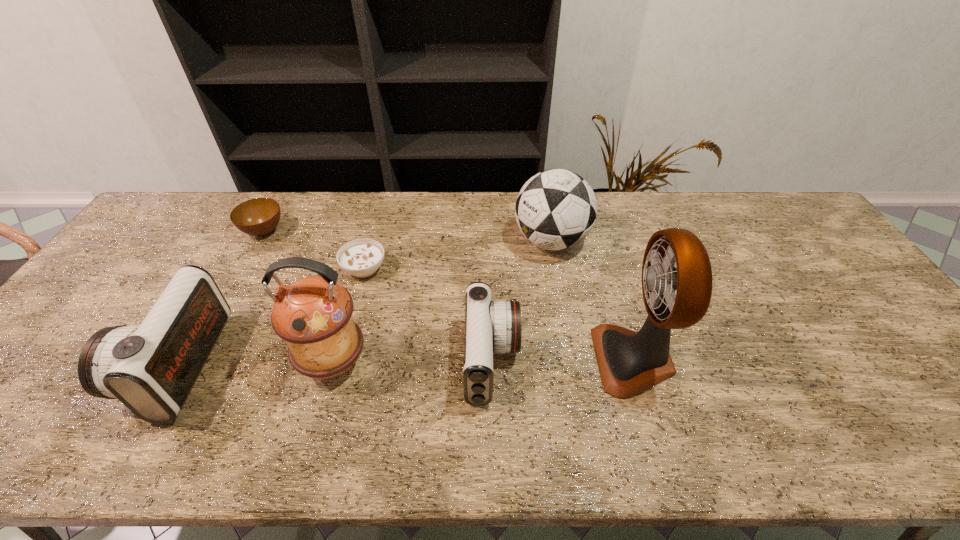
Image resolution: width=960 pixels, height=540 pixels. I want to click on free spot between the fan and the shorter camcorder, so click(x=563, y=360).

You are a GUI agent. You are given a task and a screenshot of the screen. Output one action in this format:
    pyautogui.click(x=<x>, y=<y>)
    Task: Click on the unoccupied position between the fan and the right camcorder
    
    Given the screenshot: What is the action you would take?
    pyautogui.click(x=563, y=360)

Image resolution: width=960 pixels, height=540 pixels. I want to click on free space between the third shortest object and the oil lamp, so click(x=413, y=362).

Identify the location of vacant area that lies between the bowl and the fan. The height and width of the screenshot is (540, 960). (448, 295).

What are the coordinates of `free space that is in between the soup bowl and the third tallest object` in the screenshot? It's located at (458, 255).

Locate an element on the screen. vacant area that lies between the third tallest object and the bowl is located at coordinates (407, 236).

Find the location of a particular element. vacant area between the taller camcorder and the soccer ball is located at coordinates (365, 303).

You are a GUI agent. You are given a task and a screenshot of the screen. Output one action in this format:
    pyautogui.click(x=<x>, y=<y>)
    Task: Click on the vacant space in between the oil lamp and the fifth shortest object
    
    Given the screenshot: What is the action you would take?
    pyautogui.click(x=443, y=302)

Where is `blank region between the bowl and the soup bowl`? The height and width of the screenshot is (540, 960). blank region between the bowl and the soup bowl is located at coordinates (314, 251).

Locate an element on the screen. object identified as the sixth closest to the shorter camcorder is located at coordinates (258, 217).